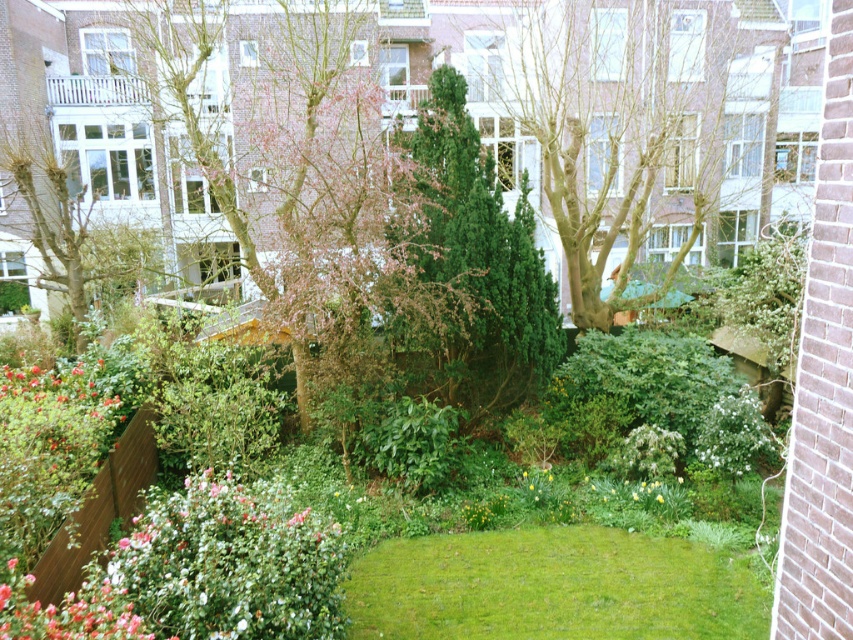
Can you confirm if pink matte flowers at lower left is thinner than bright pink petals at lower left?

Incorrect, pink matte flowers at lower left's width is not less than bright pink petals at lower left's.

Does pink matte flowers at lower left appear under bright pink petals at lower left?

Correct, pink matte flowers at lower left is located below bright pink petals at lower left.

Is point (334, 604) less distant than point (77, 428)?

That is True.

This screenshot has height=640, width=853. I want to click on pink matte flowers at lower left, so click(200, 572).

Can you confirm if green textured bush at center is smaller than pink matte flowers at lower left?

No.

Measure the distance from green textured bush at center to pink matte flowers at lower left.

green textured bush at center and pink matte flowers at lower left are 11.83 feet apart.

Between point (535, 330) and point (310, 609), which one is positioned in front?

Point (310, 609) is more forward.

You are a GUI agent. You are given a task and a screenshot of the screen. Output one action in this format:
    pyautogui.click(x=<x>, y=<y>)
    Task: Click on the green textured bush at center
    
    Given the screenshot: What is the action you would take?
    pyautogui.click(x=469, y=272)

Who is more forward, [409,540] or [20,605]?

Point [20,605]

Is point (364, 560) positioned behind point (260, 492)?

That is True.

Where is `green grass at center`? The image size is (853, 640). green grass at center is located at coordinates 553,588.